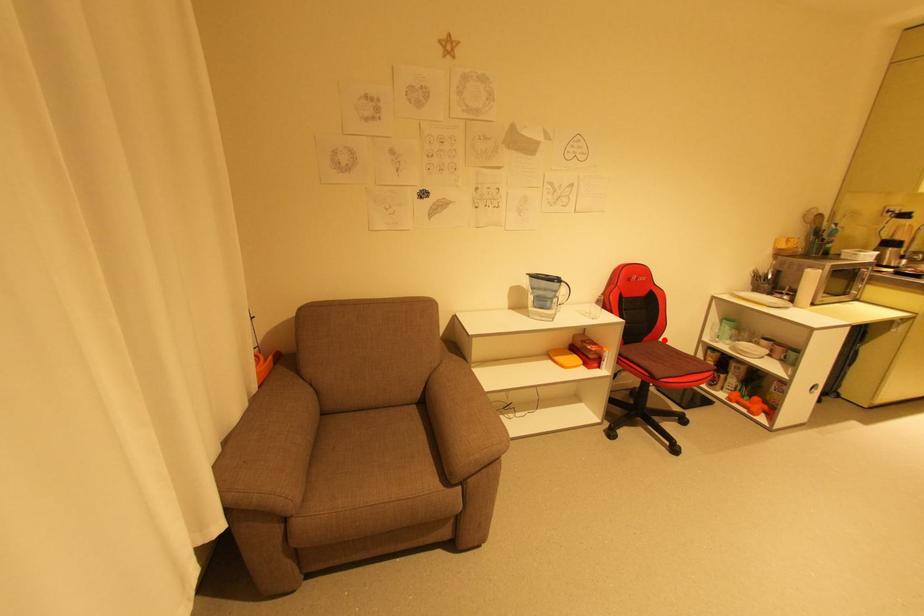
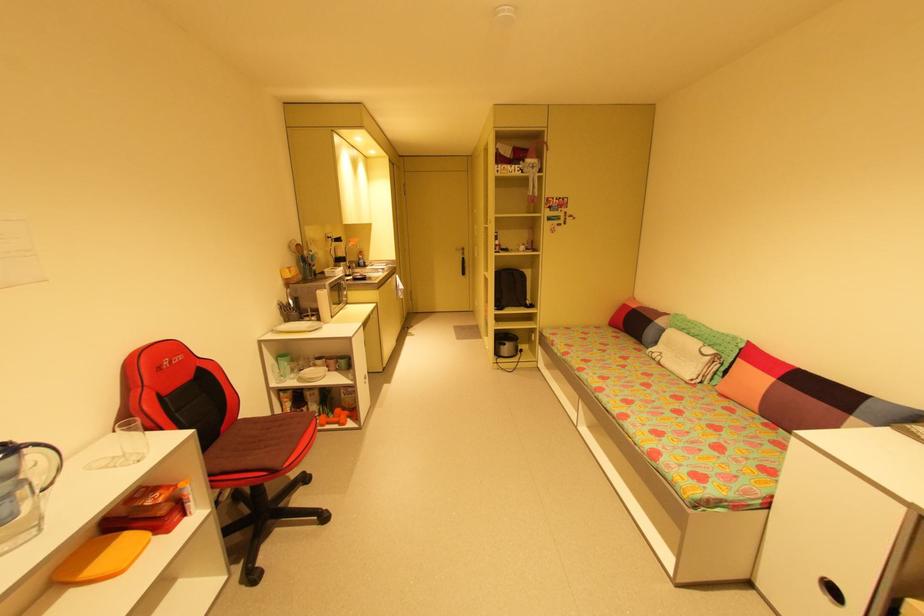
Question: A red point is marked in image1. In image2, is the corresponding 3D point closer to the camera or farther? Reply with the corresponding letter.

Choices:
 (A) The corresponding 3D point is closer.
 (B) The corresponding 3D point is farther.

Answer: (A)